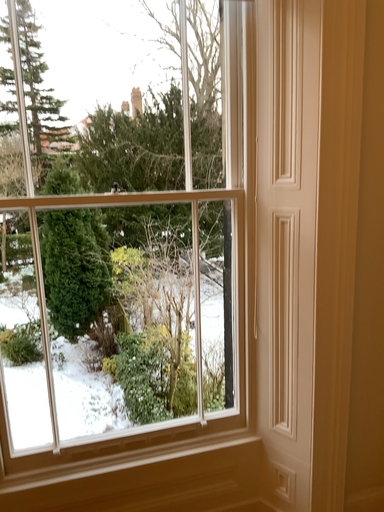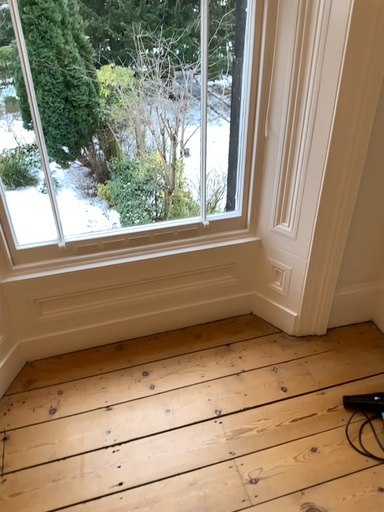
Question: Which way did the camera rotate in the video?

Choices:
 (A) rotated downward
 (B) rotated upward

Answer: (A)